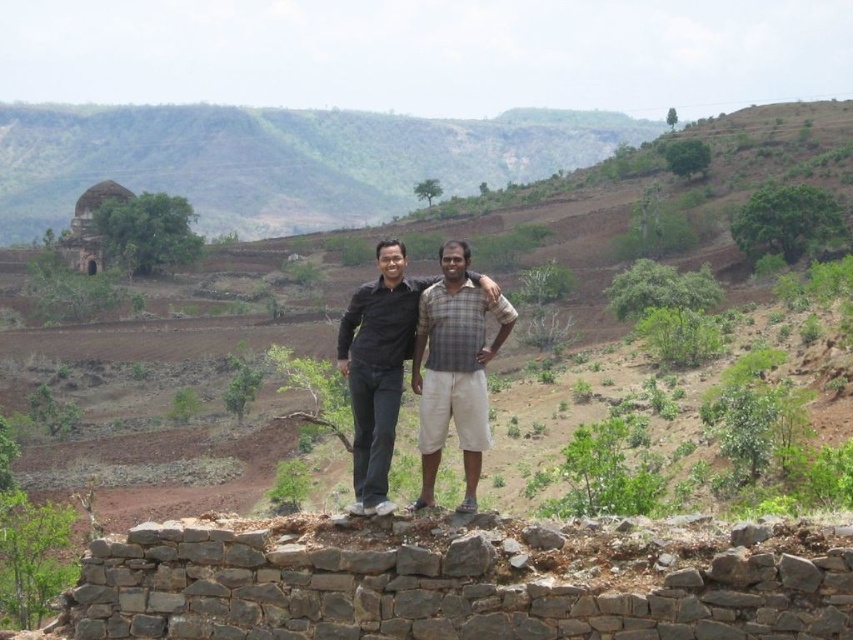
Does brown earthy hillside at left come in front of matte black shirt at center?

No, it is behind matte black shirt at center.

Does brown earthy hillside at left appear over matte black shirt at center?

Correct, brown earthy hillside at left is located above matte black shirt at center.

Who is more distant from viewer, (399, 164) or (386, 332)?

The point (399, 164) is more distant.

Where is `brown earthy hillside at left`? brown earthy hillside at left is located at coordinates (281, 160).

Does brown earthy hillside at center have a smaller size compared to matte black shirt at center?

Incorrect, brown earthy hillside at center is not smaller in size than matte black shirt at center.

From the picture: Is brown earthy hillside at center behind matte black shirt at center?

Yes.

The image size is (853, 640). What do you see at coordinates (350, 292) in the screenshot? I see `brown earthy hillside at center` at bounding box center [350, 292].

Identify the location of brown earthy hillside at center. (350, 292).

In the scene shown: Does brown earthy hillside at center come behind brown earthy hillside at left?

No.

Which is above, brown earthy hillside at center or brown earthy hillside at left?

brown earthy hillside at left is higher up.

Where is `brown earthy hillside at center`? This screenshot has height=640, width=853. brown earthy hillside at center is located at coordinates pos(350,292).